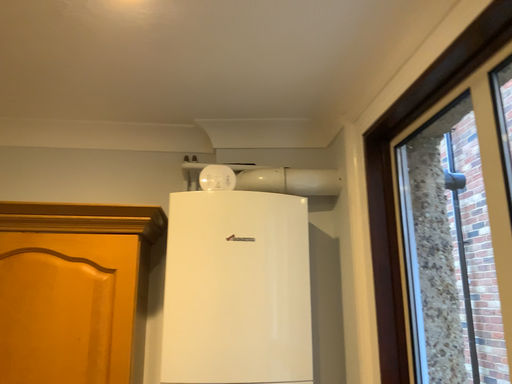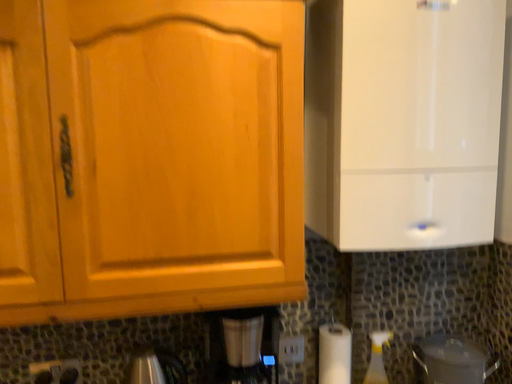
Question: Which way did the camera rotate in the video?

Choices:
 (A) rotated upward
 (B) rotated downward

Answer: (B)